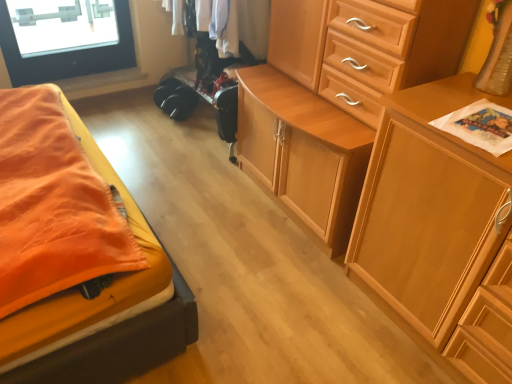
Question: Considering the positions of wooden cabinet at center, acting as the 1th chest of drawers starting from the left, and wooden cabinet at center, arranged as the 2th chest of drawers when viewed from the left, in the image, is wooden cabinet at center, acting as the 1th chest of drawers starting from the left, bigger or smaller than wooden cabinet at center, arranged as the 2th chest of drawers when viewed from the left,?

Choices:
 (A) small
 (B) big

Answer: (B)

Question: From the image's perspective, is wooden cabinet at center, acting as the 1th chest of drawers starting from the left, positioned above or below wooden cabinet at center, which appears as the first chest of drawers when viewed from the right?

Choices:
 (A) below
 (B) above

Answer: (B)

Question: Which object is the farthest from the wooden cabinet at center, acting as the 1th chest of drawers starting from the left?

Choices:
 (A) wooden cabinet at center, arranged as the 2th chest of drawers when viewed from the left
 (B) black fabric clothing at center

Answer: (B)

Question: Based on their relative distances, which object is farther from the wooden cabinet at center, positioned as the 2th chest of drawers in right-to-left order?

Choices:
 (A) black fabric clothing at center
 (B) wooden cabinet at center, which appears as the first chest of drawers when viewed from the right

Answer: (A)